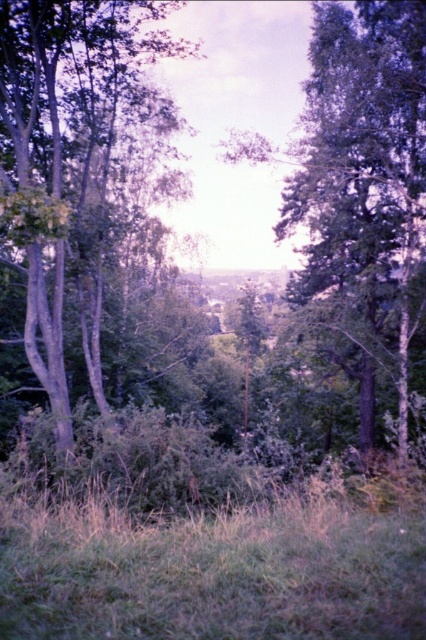
Question: Which of these objects is positioned farthest from the green matte tree at center?

Choices:
 (A) smooth gray tree at left
 (B) green grass at lower center

Answer: (B)

Question: Which of the following is the farthest from the observer?

Choices:
 (A) green grass at lower center
 (B) green matte tree at center

Answer: (B)

Question: Which object is closer to the camera taking this photo?

Choices:
 (A) green grass at lower center
 (B) green matte tree at center
 (C) smooth gray tree at left

Answer: (A)

Question: Does smooth gray tree at left have a smaller size compared to green grass at lower center?

Choices:
 (A) yes
 (B) no

Answer: (B)

Question: Is smooth gray tree at left bigger than green grass at lower center?

Choices:
 (A) yes
 (B) no

Answer: (A)

Question: Can you confirm if green grass at lower center is positioned to the left of green matte tree at center?

Choices:
 (A) no
 (B) yes

Answer: (B)